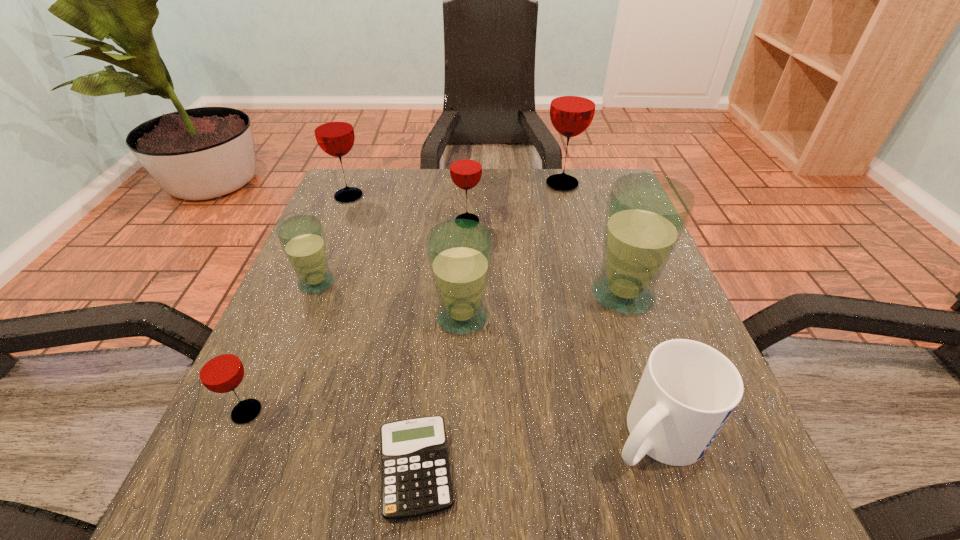
Where is `free space at the far left corner`? The image size is (960, 540). free space at the far left corner is located at coordinates (361, 180).

The width and height of the screenshot is (960, 540). I want to click on vacant point located between the second blue glass from right to left and the second biggest red glass, so click(405, 256).

Image resolution: width=960 pixels, height=540 pixels. Find the location of `free area in between the mug and the rightmost blue glass`. free area in between the mug and the rightmost blue glass is located at coordinates (639, 364).

Identify the location of vacant area between the second smallest blue glass and the leftmost blue glass. (390, 300).

The height and width of the screenshot is (540, 960). Identify the location of vacant space that's between the calculator and the mug. (537, 452).

Where is `unoccupied position between the biggest blue glass and the mug`? Image resolution: width=960 pixels, height=540 pixels. unoccupied position between the biggest blue glass and the mug is located at coordinates (639, 364).

Identify the location of vacant area that lies between the third smallest red glass and the mug. (502, 315).

This screenshot has width=960, height=540. In order to click on unoccupied area between the second biggest red glass and the second smallest red glass in this screenshot , I will do `click(408, 208)`.

This screenshot has width=960, height=540. What are the coordinates of `vacant area that lies between the second blue glass from left to right and the mug` in the screenshot? It's located at (560, 376).

You are a GUI agent. You are given a task and a screenshot of the screen. Output one action in this format:
    pyautogui.click(x=<x>, y=<y>)
    Task: Click on the vacant area that lies between the calculator and the third smallest red glass
    This screenshot has height=540, width=960.
    Given the screenshot: What is the action you would take?
    pyautogui.click(x=382, y=333)